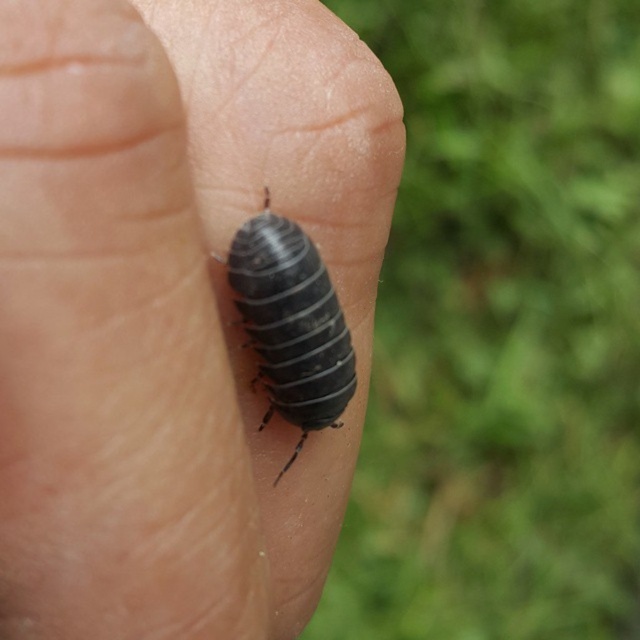
Between matte black bug at center and shiny black beetle at center, which one has less height?

Standing shorter between the two is shiny black beetle at center.

Does matte black bug at center appear on the right side of shiny black beetle at center?

Incorrect, matte black bug at center is not on the right side of shiny black beetle at center.

This screenshot has height=640, width=640. I want to click on matte black bug at center, so click(172, 307).